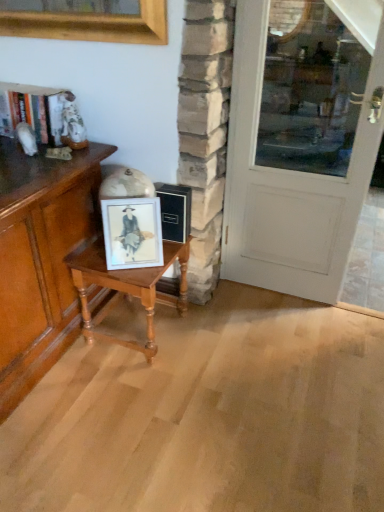
I want to click on free space in front of matte white frame at center, so click(x=132, y=276).